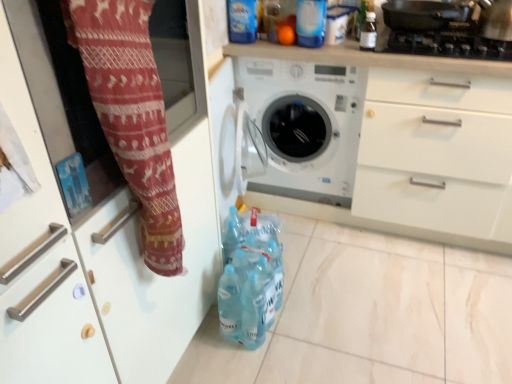
You are a GUI agent. You are given a task and a screenshot of the screen. Output one action in this format:
    pyautogui.click(x=<x>, y=<y>)
    Task: Click on the vacant area located to the right-hand side of translucent plastic bottles at lower center, placed as the first bottle when sorted from bottom to top
    Image resolution: width=512 pixels, height=384 pixels.
    Given the screenshot: What is the action you would take?
    pyautogui.click(x=316, y=321)